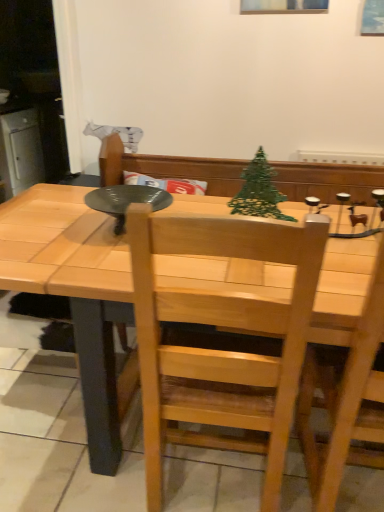
The width and height of the screenshot is (384, 512). In order to click on free space to the left of natural wood chair at center in this screenshot , I will do `click(91, 473)`.